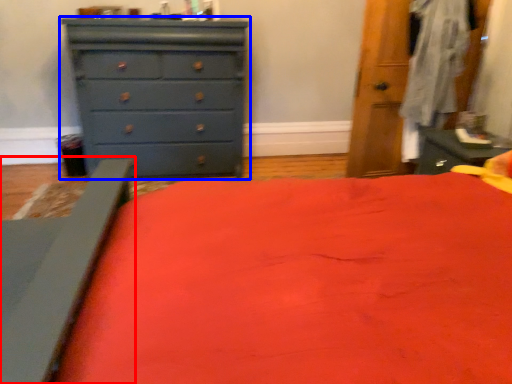
Question: Which point is further to the camera, bed frame (highlighted by a red box) or chest of drawers (highlighted by a blue box)?

Choices:
 (A) bed frame
 (B) chest of drawers

Answer: (B)